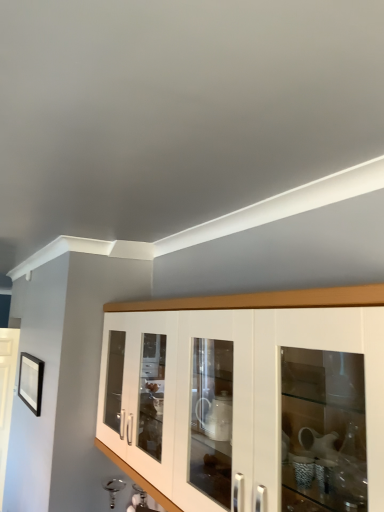
Question: Considering the positions of white glossy cabinet at center and black matte picture frame at upper left in the image, is white glossy cabinet at center taller or shorter than black matte picture frame at upper left?

Choices:
 (A) short
 (B) tall

Answer: (B)

Question: Is point (102, 385) closer or farther from the camera than point (33, 389)?

Choices:
 (A) closer
 (B) farther

Answer: (A)

Question: Considering their positions, is white glossy cabinet at center located in front of or behind black matte picture frame at upper left?

Choices:
 (A) behind
 (B) front

Answer: (B)

Question: In terms of size, does black matte picture frame at upper left appear bigger or smaller than white glossy cabinet at center?

Choices:
 (A) big
 (B) small

Answer: (B)

Question: Is black matte picture frame at upper left in front of or behind white glossy cabinet at center in the image?

Choices:
 (A) behind
 (B) front

Answer: (A)

Question: Is black matte picture frame at upper left situated inside white glossy cabinet at center or outside?

Choices:
 (A) inside
 (B) outside

Answer: (B)

Question: From a real-world perspective, is black matte picture frame at upper left above or below white glossy cabinet at center?

Choices:
 (A) above
 (B) below

Answer: (B)